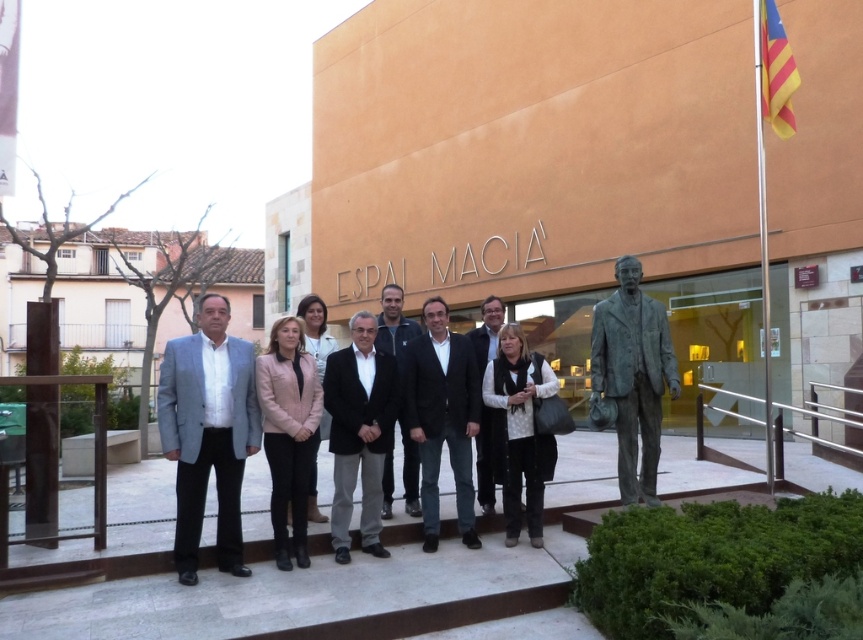
Can you confirm if matte black suit at center is bigger than black matte jacket at center?

Incorrect, matte black suit at center is not larger than black matte jacket at center.

At what (x,y) coordinates should I click in order to perform the action: click on matte black suit at center. Please return your answer as a coordinate pair (x, y). This screenshot has height=640, width=863. Looking at the image, I should click on (489, 456).

Does point (487, 497) lie in front of point (394, 296)?

Yes, it is in front of point (394, 296).

Identify the location of matte black suit at center. This screenshot has height=640, width=863. (489, 456).

Identify the location of bronze statue at right. This screenshot has height=640, width=863. (633, 376).

Between bronze statue at right and black suit at center, which one is positioned higher?

bronze statue at right

Does point (640, 358) come farther from viewer compared to point (419, 433)?

Yes, point (640, 358) is farther from viewer.

Identify the location of bronze statue at right. Image resolution: width=863 pixels, height=640 pixels. (633, 376).

Can you confirm if light gray suit at center is positioned above black suit at center?

Yes.

What do you see at coordinates (208, 433) in the screenshot? This screenshot has width=863, height=640. I see `light gray suit at center` at bounding box center [208, 433].

Is point (202, 513) behind point (457, 378)?

No, it is not.

The image size is (863, 640). In order to click on light gray suit at center in this screenshot , I will do `click(208, 433)`.